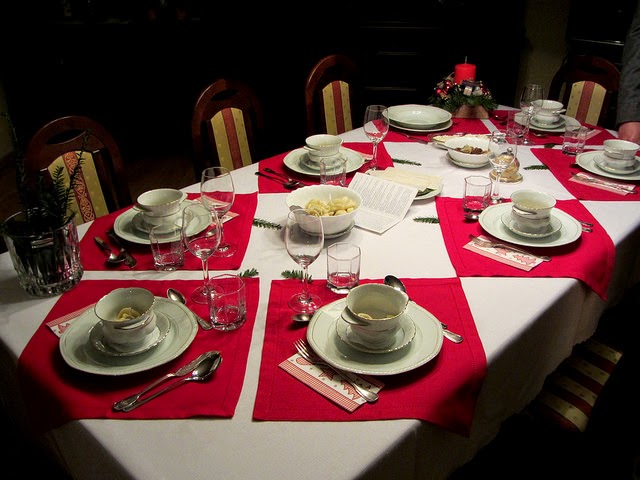
Where is `red placemats`? The width and height of the screenshot is (640, 480). red placemats is located at coordinates (429, 396), (224, 391), (230, 257), (273, 181), (400, 134), (459, 221), (562, 156), (544, 136).